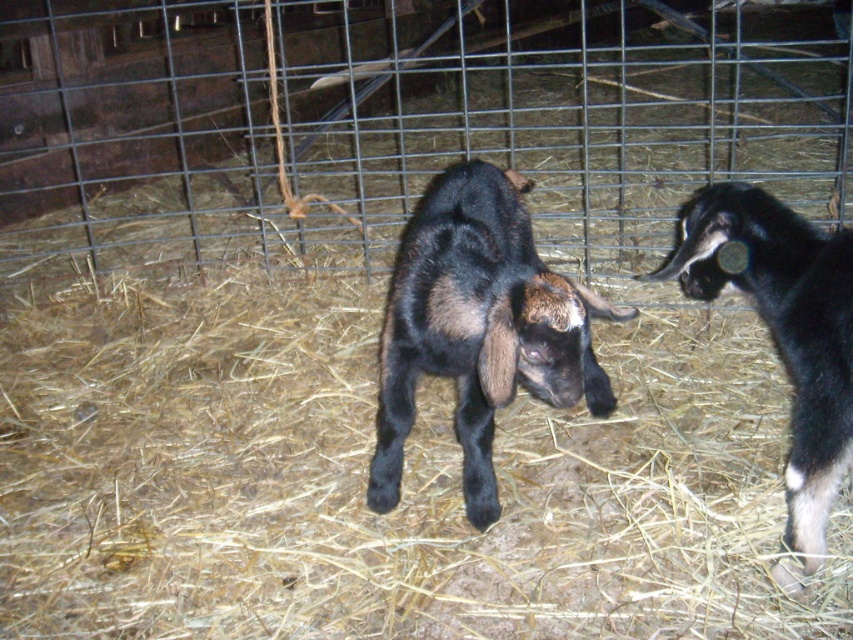
You are a farmer who needs to separate these two goats using a divider that is 40 centimeters wide. Based on the image, will the divider fit between the black soft fur goat at center and the black matte goat at right without touching either of them?

The distance between the black soft fur goat at center and the black matte goat at right is 44.36 centimeters. Subtracting the width of the divider, which is 40 centimeters, leaves 4.36 centimeters of space. This means there is enough space to place the divider between them without touching either goat.

You are a farmer who needs to transport the black soft fur goat at center and the black matte goat at right to a new barn. The gate to the barn has a height restriction of 1.2 meters. Can both goats pass through the gate without any issues?

The black soft fur goat at center is smaller than the black matte goat at right. Since the gate has a height restriction of 1.2 meters, both goats can pass through as long as their heights are under 1.2 meters. However, without specific height measurements, it is impossible to determine if they will fit.

You are a farmer who needs to identify which goat is taller for breeding purposes. You see the black soft fur goat at center and the black matte goat at right in the pen. Which one is taller?

The black soft fur goat at center is taller than the black matte goat at right according to the description.